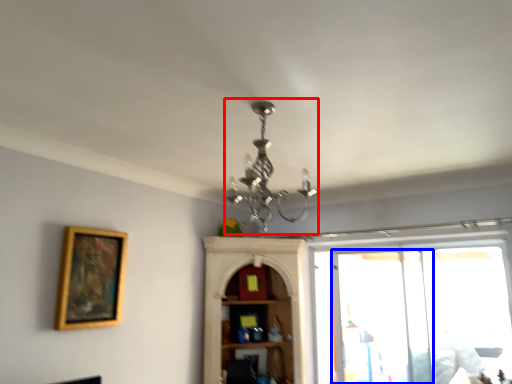
Question: Which point is closer to the camera, light fixture (highlighted by a red box) or screen door (highlighted by a blue box)?

Choices:
 (A) light fixture
 (B) screen door

Answer: (A)